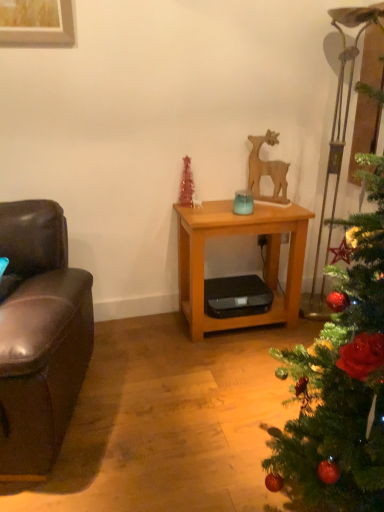
Question: Is wooden table at center located within wooden deer at center?

Choices:
 (A) yes
 (B) no

Answer: (B)

Question: Is wooden deer at center outside wooden table at center?

Choices:
 (A) no
 (B) yes

Answer: (B)

Question: Can you confirm if wooden deer at center is shorter than wooden table at center?

Choices:
 (A) yes
 (B) no

Answer: (A)

Question: Is wooden deer at center smaller than wooden table at center?

Choices:
 (A) no
 (B) yes

Answer: (B)

Question: From a real-world perspective, is wooden deer at center physically above wooden table at center?

Choices:
 (A) no
 (B) yes

Answer: (B)

Question: Is green matte christmas tree at right to the left or to the right of wooden table at center in the image?

Choices:
 (A) left
 (B) right

Answer: (B)

Question: Is green matte christmas tree at right inside the boundaries of wooden table at center, or outside?

Choices:
 (A) outside
 (B) inside

Answer: (A)

Question: Does point (375, 238) appear closer or farther from the camera than point (211, 232)?

Choices:
 (A) farther
 (B) closer

Answer: (B)

Question: Is green matte christmas tree at right in front of or behind wooden table at center in the image?

Choices:
 (A) front
 (B) behind

Answer: (A)

Question: Does point (380, 359) appear closer or farther from the camera than point (26, 398)?

Choices:
 (A) closer
 (B) farther

Answer: (A)

Question: Is green matte christmas tree at right spatially inside brown leather couch at left, or outside of it?

Choices:
 (A) outside
 (B) inside

Answer: (A)

Question: Considering the positions of green matte christmas tree at right and brown leather couch at left in the image, is green matte christmas tree at right bigger or smaller than brown leather couch at left?

Choices:
 (A) big
 (B) small

Answer: (A)

Question: Considering the positions of green matte christmas tree at right and brown leather couch at left in the image, is green matte christmas tree at right wider or thinner than brown leather couch at left?

Choices:
 (A) wide
 (B) thin

Answer: (B)

Question: Considering the positions of wooden table at center and wooden deer at center in the image, is wooden table at center taller or shorter than wooden deer at center?

Choices:
 (A) tall
 (B) short

Answer: (A)

Question: Considering the positions of wooden table at center and wooden deer at center in the image, is wooden table at center bigger or smaller than wooden deer at center?

Choices:
 (A) big
 (B) small

Answer: (A)